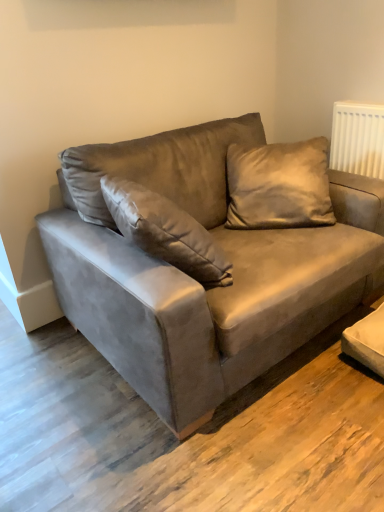
Image resolution: width=384 pixels, height=512 pixels. Describe the element at coordinates (279, 185) in the screenshot. I see `suede pillow at upper right` at that location.

The image size is (384, 512). Find the location of `suede pillow at upper right`. suede pillow at upper right is located at coordinates (279, 185).

The height and width of the screenshot is (512, 384). What do you see at coordinates (199, 283) in the screenshot?
I see `suede couch at center` at bounding box center [199, 283].

This screenshot has height=512, width=384. What are the coordinates of `suede couch at center` in the screenshot? It's located at (199, 283).

At what (x,y) coordinates should I click in order to perform the action: click on suede pillow at upper right. Please return your answer as a coordinate pair (x, y). The width and height of the screenshot is (384, 512). Looking at the image, I should click on (279, 185).

Is suede couch at center to the right of suede pillow at upper right from the viewer's perspective?

Incorrect, suede couch at center is not on the right side of suede pillow at upper right.

Does suede couch at center come in front of suede pillow at upper right?

Yes, it is in front of suede pillow at upper right.

Which is less distant, (323, 318) or (306, 203)?

The point (323, 318) is in front.

From the image's perspective, which is below, suede couch at center or suede pillow at upper right?

suede couch at center.

From a real-world perspective, is suede couch at center under suede pillow at upper right?

Yes, from a real-world perspective, suede couch at center is under suede pillow at upper right.

In terms of width, does suede couch at center look wider or thinner when compared to suede pillow at upper right?

Considering their sizes, suede couch at center looks broader than suede pillow at upper right.

Between suede couch at center and suede pillow at upper right, which one has less height?

suede pillow at upper right.

Between suede couch at center and suede pillow at upper right, which one has smaller size?

suede pillow at upper right is smaller.

Is suede pillow at upper right located within suede couch at center?

Absolutely, suede pillow at upper right is inside suede couch at center.

Is suede couch at center positioned far away from suede pillow at upper right?

No, suede couch at center is in close proximity to suede pillow at upper right.

Is suede couch at center turned away from suede pillow at upper right?

Yes, suede pillow at upper right is at the back of suede couch at center.

Where is `studio couch below the suede pillow at upper right (from the image's perspective)`? This screenshot has height=512, width=384. studio couch below the suede pillow at upper right (from the image's perspective) is located at coordinates [x=199, y=283].

Which is more to the left, suede pillow at upper right or suede couch at center?

Positioned to the left is suede couch at center.

Which object is further away from the camera, suede pillow at upper right or suede couch at center?

suede pillow at upper right is more distant.

Does point (286, 217) come in front of point (121, 311)?

No, (286, 217) is behind (121, 311).

From the image's perspective, is suede pillow at upper right located beneath suede couch at center?

Incorrect, from the image's perspective, suede pillow at upper right is higher than suede couch at center.

From a real-world perspective, is suede pillow at upper right above or below suede couch at center?

suede pillow at upper right is situated higher than suede couch at center in the real world.

In the scene shown: Which object is wider, suede pillow at upper right or suede couch at center?

suede couch at center.

Between suede pillow at upper right and suede couch at center, which one has more height?

suede couch at center is taller.

Based on their sizes in the image, would you say suede pillow at upper right is bigger or smaller than suede couch at center?

Considering their sizes, suede pillow at upper right takes up less space than suede couch at center.

Is suede couch at center located within suede pillow at upper right?

No, suede couch at center is not surrounded by suede pillow at upper right.

Is suede pillow at upper right not near suede couch at center?

suede pillow at upper right is actually quite close to suede couch at center.

Is suede couch at center at the back of suede pillow at upper right?

Yes, suede couch at center is at the back of suede pillow at upper right.

Consider the image. How many degrees apart are the facing directions of suede pillow at upper right and suede couch at center?

44.8 degrees separate the facing orientations of suede pillow at upper right and suede couch at center.

Find the location of `pillow above the suede couch at center (from a real-world perspective)`. pillow above the suede couch at center (from a real-world perspective) is located at coordinates (279, 185).

Identify the location of studio couch on the left of suede pillow at upper right. This screenshot has height=512, width=384. (199, 283).

The width and height of the screenshot is (384, 512). I want to click on pillow that appears above the suede couch at center (from a real-world perspective), so click(x=279, y=185).